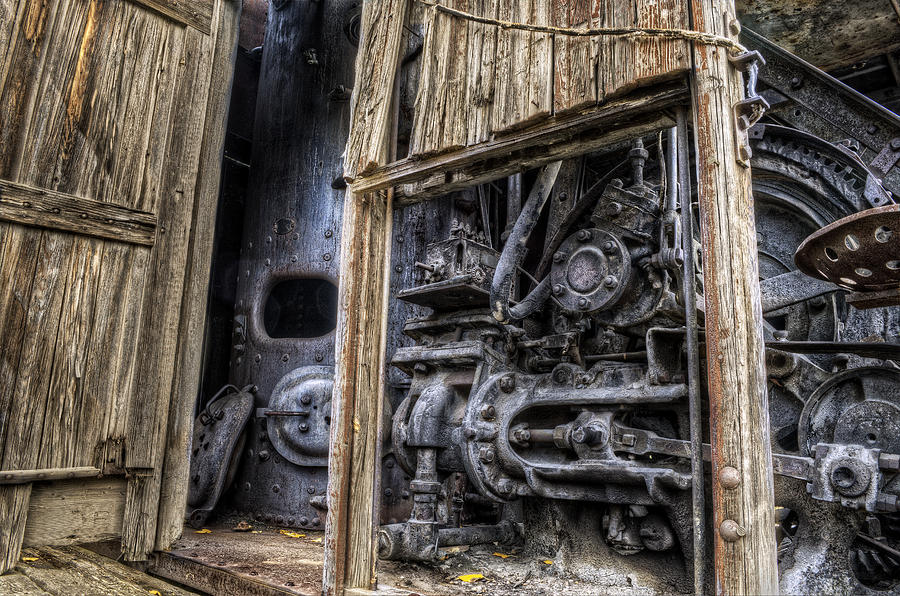
The height and width of the screenshot is (596, 900). What are the coordinates of `wooden wall` in the screenshot? It's located at (86, 156), (66, 392).